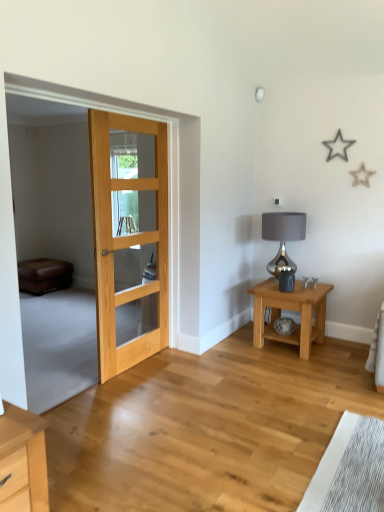
You are a GUI agent. You are given a task and a screenshot of the screen. Output one action in this format:
    pyautogui.click(x=<x>, y=<y>)
    Task: Click on the free space in front of natural wood door at left
    The height and width of the screenshot is (512, 384).
    Given the screenshot: What is the action you would take?
    pyautogui.click(x=138, y=394)